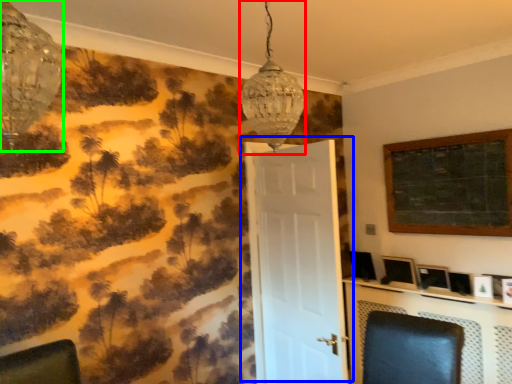
Question: Which is farther away from lamp (highlighted by a red box)? door (highlighted by a blue box) or lamp (highlighted by a green box)?

Choices:
 (A) door
 (B) lamp

Answer: (A)